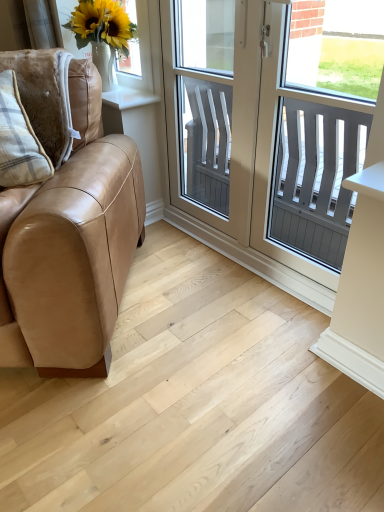
You are a GUI agent. You are given a task and a screenshot of the screen. Output one action in this format:
    pyautogui.click(x=<x>, y=<y>)
    Task: Click on the free point to the right of tan leather couch at left
    This screenshot has height=512, width=384.
    Given the screenshot: What is the action you would take?
    pyautogui.click(x=221, y=332)